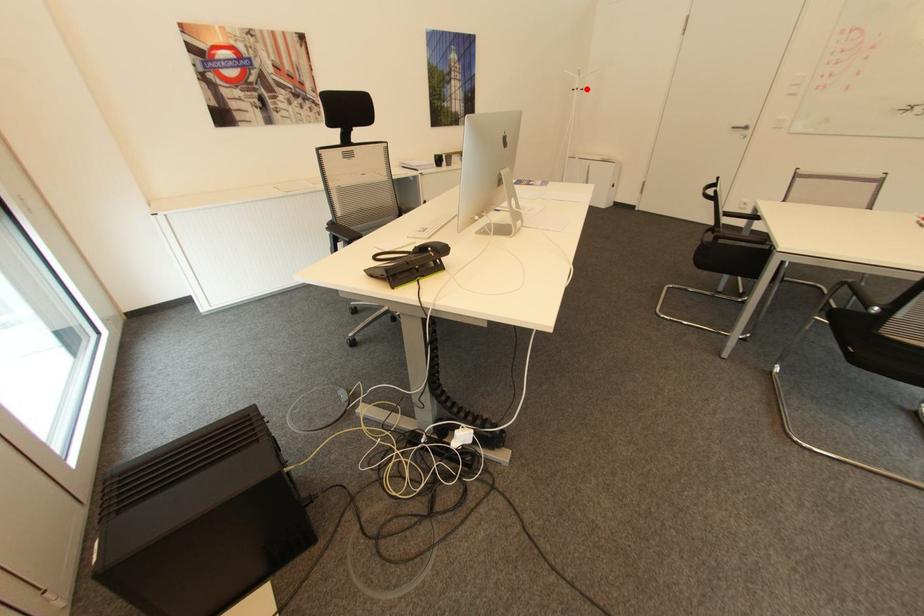
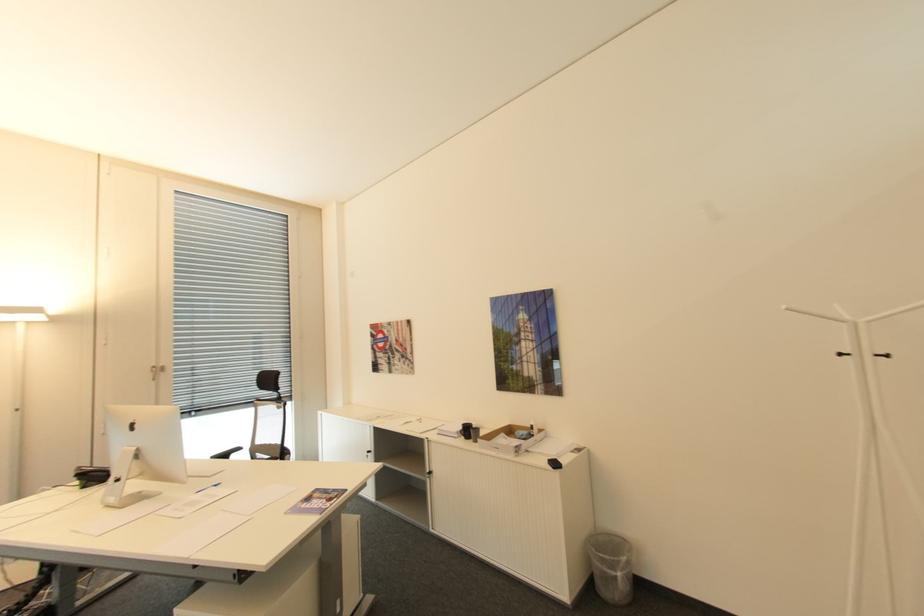
Find the pixel in the second image that matches the highlighted location in the first image.

(894, 355)